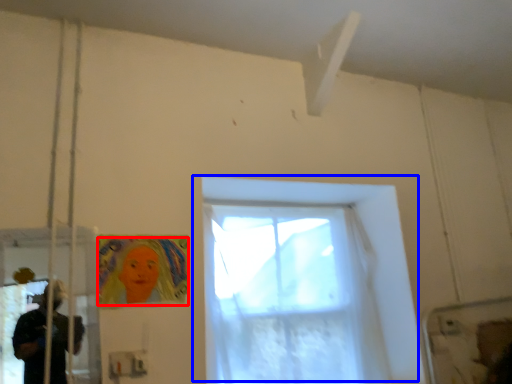
Question: Which of the following is the closest to the observer, woman (highlighted by a red box) or window (highlighted by a blue box)?

Choices:
 (A) woman
 (B) window

Answer: (A)